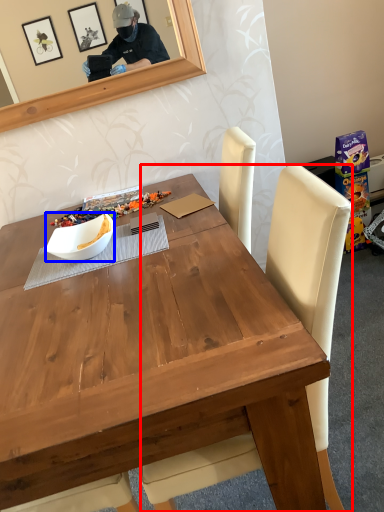
Question: Which object is closer to the camera taking this photo, chair (highlighted by a red box) or bowl (highlighted by a blue box)?

Choices:
 (A) chair
 (B) bowl

Answer: (A)